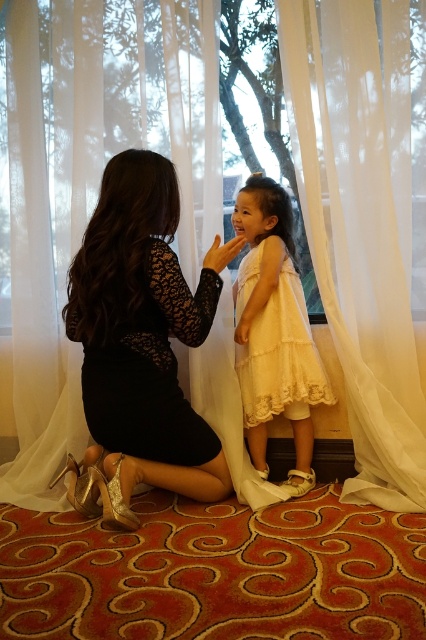
Question: Can you confirm if white sheer curtain at center is positioned above yellow lace dress at center?

Choices:
 (A) yes
 (B) no

Answer: (A)

Question: Is white sheer curtain at center bigger than yellow lace dress at center?

Choices:
 (A) yes
 (B) no

Answer: (A)

Question: Does white sheer curtain at center have a smaller size compared to yellow lace dress at center?

Choices:
 (A) no
 (B) yes

Answer: (A)

Question: Which point is farther to the camera?

Choices:
 (A) yellow lace dress at center
 (B) black lace dress at center

Answer: (A)

Question: Which point is closer to the camera taking this photo?

Choices:
 (A) (282, 413)
 (B) (365, 488)
 (C) (109, 394)

Answer: (C)

Question: Among these objects, which one is nearest to the camera?

Choices:
 (A) yellow lace dress at center
 (B) black lace dress at center

Answer: (B)